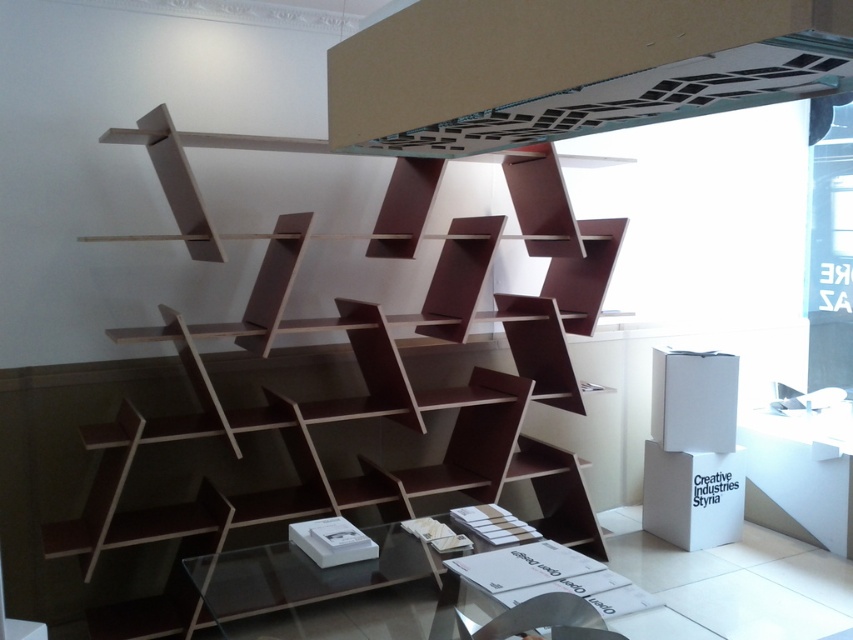
Question: Is brown matte bookcase at center below matte white exhaust hood at upper center?

Choices:
 (A) no
 (B) yes

Answer: (B)

Question: Can you confirm if brown matte bookcase at center is positioned above matte white exhaust hood at upper center?

Choices:
 (A) no
 (B) yes

Answer: (A)

Question: Which point is closer to the camera?

Choices:
 (A) (381, 348)
 (B) (651, 97)

Answer: (B)

Question: Which object appears closest to the camera in this image?

Choices:
 (A) brown matte bookcase at center
 (B) matte white exhaust hood at upper center

Answer: (B)

Question: Is brown matte bookcase at center further to camera compared to matte white exhaust hood at upper center?

Choices:
 (A) no
 (B) yes

Answer: (B)